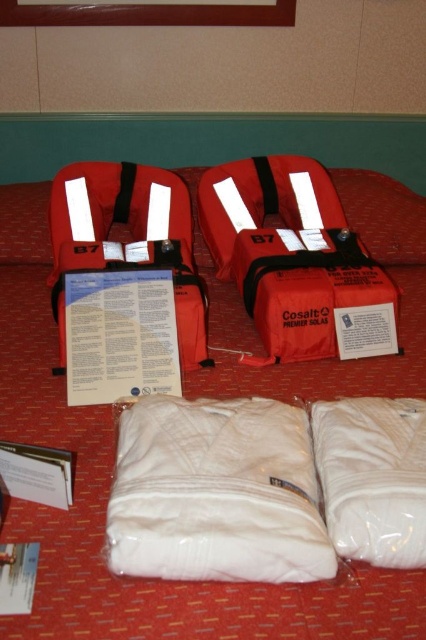
Between point (94, 461) and point (172, 180), which one is positioned in front?

Positioned in front is point (94, 461).

This screenshot has height=640, width=426. Identify the location of matte red life jackets at center. (106, 499).

Locate an element on the screen. The height and width of the screenshot is (640, 426). matte red life jackets at center is located at coordinates (106, 499).

At what (x,y) coordinates should I click in order to perform the action: click on matte red life jackets at center. Please return your answer as a coordinate pair (x, y). The width and height of the screenshot is (426, 640). Looking at the image, I should click on (106, 499).

Who is positioned more to the left, white soft sleeping bag at lower right or matte orange life jacket at center?

matte orange life jacket at center

Is white soft sleeping bag at lower right in front of matte orange life jacket at center?

That is True.

I want to click on white soft sleeping bag at lower right, so click(x=373, y=477).

Does white soft sleeping bag at lower right appear under matte red life jacket at center?

Correct, white soft sleeping bag at lower right is located below matte red life jacket at center.

Can you confirm if white soft sleeping bag at lower right is shorter than matte red life jacket at center?

Indeed, white soft sleeping bag at lower right has a lesser height compared to matte red life jacket at center.

Is point (336, 548) in front of point (132, 225)?

Yes, it is in front of point (132, 225).

In order to click on white soft sleeping bag at lower right in this screenshot , I will do `click(373, 477)`.